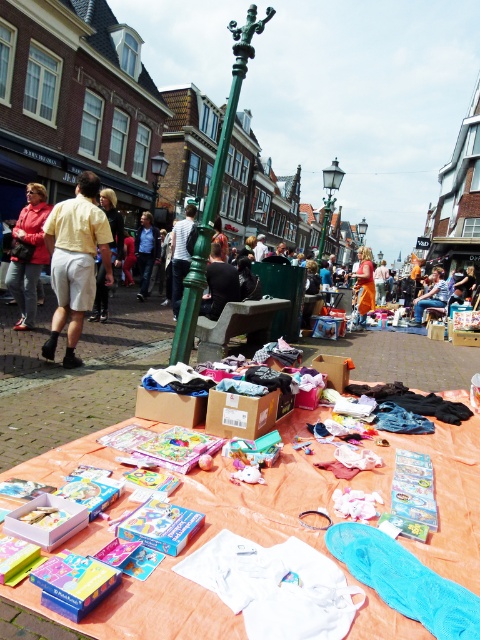
Is blue denim jeans at center behind green metal streetlight at center?

No, it is in front of green metal streetlight at center.

The width and height of the screenshot is (480, 640). What do you see at coordinates (146, 252) in the screenshot? I see `blue denim jeans at center` at bounding box center [146, 252].

You are a GUI agent. You are given a task and a screenshot of the screen. Output one action in this format:
    pyautogui.click(x=<x>, y=<y>)
    Task: Click on the blue denim jeans at center
    
    Given the screenshot: What is the action you would take?
    pyautogui.click(x=146, y=252)

Describe the element at coordinates (116, 232) in the screenshot. I see `light beige cotton shorts at left` at that location.

In the scene shown: Between light beige cotton shorts at left and orange cotton dress at center, which one appears on the right side from the viewer's perspective?

Positioned to the right is orange cotton dress at center.

Does point (113, 253) lie behind point (424, 298)?

That is False.

Locate an element on the screen. Image resolution: width=480 pixels, height=640 pixels. light beige cotton shorts at left is located at coordinates (116, 232).

Can you confirm if light beige cotton shorts at left is taller than orange cotton shirt at center?

No, light beige cotton shorts at left is not taller than orange cotton shirt at center.

Who is taller, light beige cotton shorts at left or orange cotton shirt at center?

orange cotton shirt at center

The image size is (480, 640). Identify the location of light beige cotton shorts at left. (116, 232).